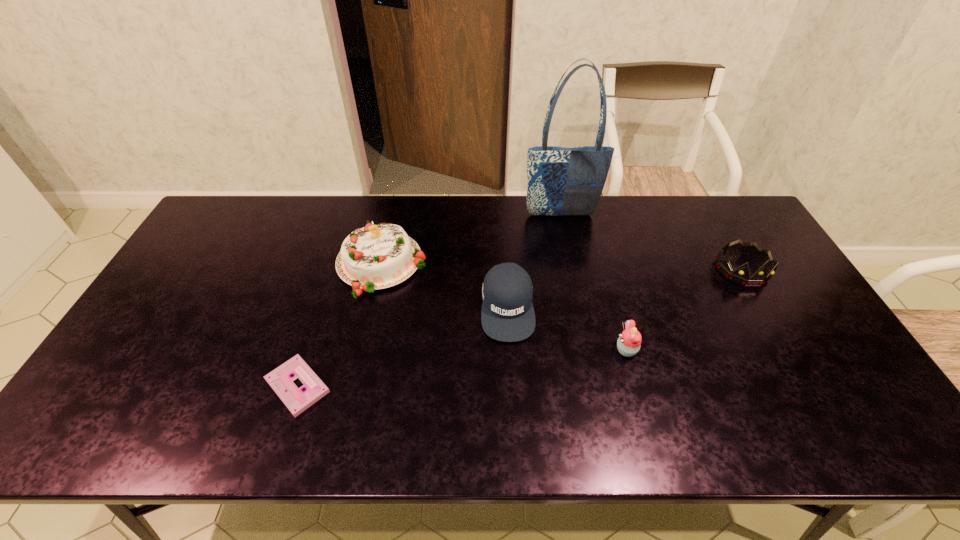
Where is `free space at the near edge of the desktop`? free space at the near edge of the desktop is located at coordinates (724, 421).

Find the location of a particular element. free space at the left edge of the desktop is located at coordinates (149, 406).

Image resolution: width=960 pixels, height=540 pixels. I want to click on free spot at the right edge of the desktop, so click(x=801, y=306).

Where is `free location at the far left corner`? free location at the far left corner is located at coordinates (235, 239).

Image resolution: width=960 pixels, height=540 pixels. In order to click on vacant region between the tallest object and the videotape in this screenshot , I will do `click(429, 301)`.

Where is `empty space that is in between the shopping bag and the videotape`? This screenshot has width=960, height=540. empty space that is in between the shopping bag and the videotape is located at coordinates (429, 301).

Locate an element on the screen. This screenshot has width=960, height=540. vacant region between the shortest object and the fifth shortest object is located at coordinates 339,326.

The image size is (960, 540). What are the coordinates of `free area in between the tallest object and the rightmost object` in the screenshot? It's located at (651, 242).

Locate an element on the screen. This screenshot has height=540, width=960. free space that is in between the rightmost object and the cake is located at coordinates (562, 267).

The height and width of the screenshot is (540, 960). What are the coordinates of `vacant area that lies between the second tallest object and the shortest object` in the screenshot? It's located at (339, 326).